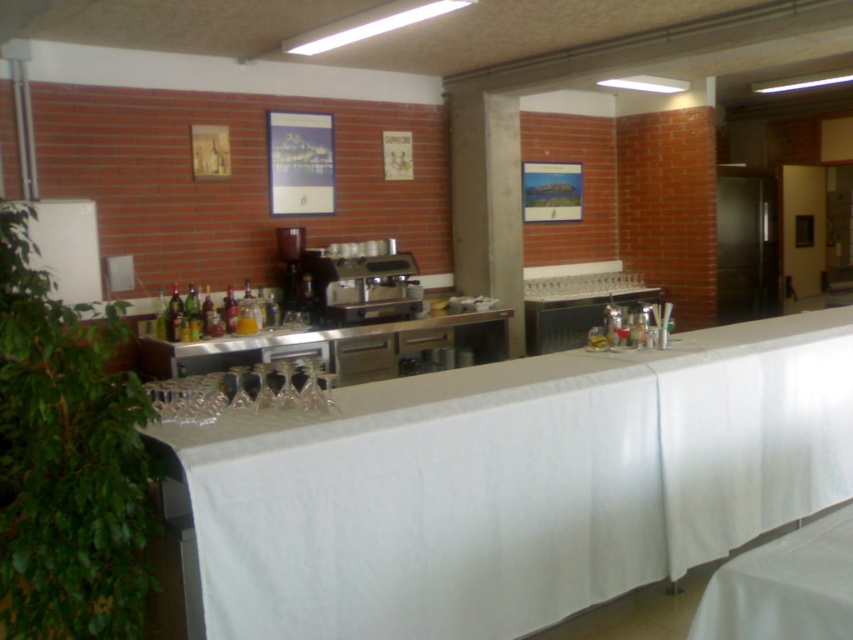
Can you confirm if white fabric table at center is positioned below stainless steel counter at center?

Indeed, white fabric table at center is positioned under stainless steel counter at center.

Which is in front, point (300, 508) or point (451, 323)?

Positioned in front is point (300, 508).

At what (x,y) coordinates should I click in order to perform the action: click on white fabric table at center. Please return your answer as a coordinate pair (x, y). Image resolution: width=853 pixels, height=640 pixels. Looking at the image, I should click on (514, 483).

Between white fabric table at center and satin silver coffee machine at center, which one is positioned lower?

Positioned lower is white fabric table at center.

Does white fabric table at center have a lesser width compared to satin silver coffee machine at center?

No.

This screenshot has height=640, width=853. What do you see at coordinates (514, 483) in the screenshot? I see `white fabric table at center` at bounding box center [514, 483].

The height and width of the screenshot is (640, 853). I want to click on white fabric table at center, so click(514, 483).

Does stainless steel counter at center lie behind satin silver coffee machine at center?

That is False.

Can you confirm if stainless steel counter at center is taller than satin silver coffee machine at center?

No.

Which is behind, point (457, 340) or point (276, 228)?

The point (457, 340) is behind.

Locate an element on the screen. This screenshot has height=640, width=853. stainless steel counter at center is located at coordinates (335, 346).